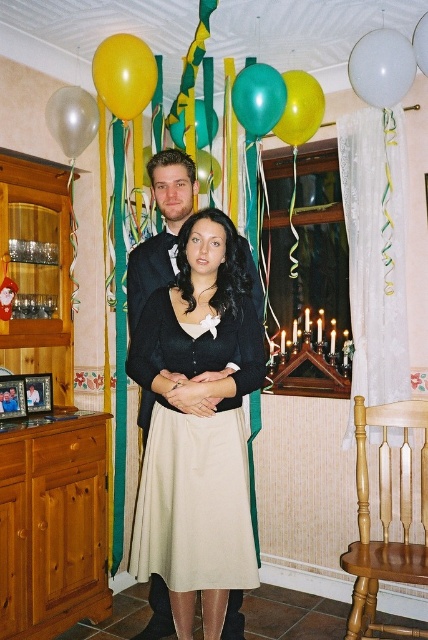
Based on the photo, you are planning to hang a new decoration between the transparent plastic balloon at upper center and the transparent white balloon at upper left. Based on their positions, which balloon should you place the decoration closer to in order to maintain balance?

The transparent plastic balloon at upper center is positioned over the transparent white balloon at upper left. To maintain balance, you should place the new decoration closer to the transparent white balloon at upper left since it is lower and might need visual weight compensation.

You are planning to hang a new decoration that requires knowing which balloon is taller between the transparent plastic balloon at upper center and the transparent white balloon at upper left. Based on the scene, which one is taller?

The transparent white balloon at upper left is taller than the transparent plastic balloon at upper center.

You are standing in the festive indoor scene and want to place a small gift box exactly at point [246,500]. If your arm can reach up to 1.8 meters, can you reach that point?

The distance of point [246,500] from camera is 2.05 meters, so the point is 2.05 meters away from you. Since your arm can reach up to 1.8 meters, you cannot reach that point.